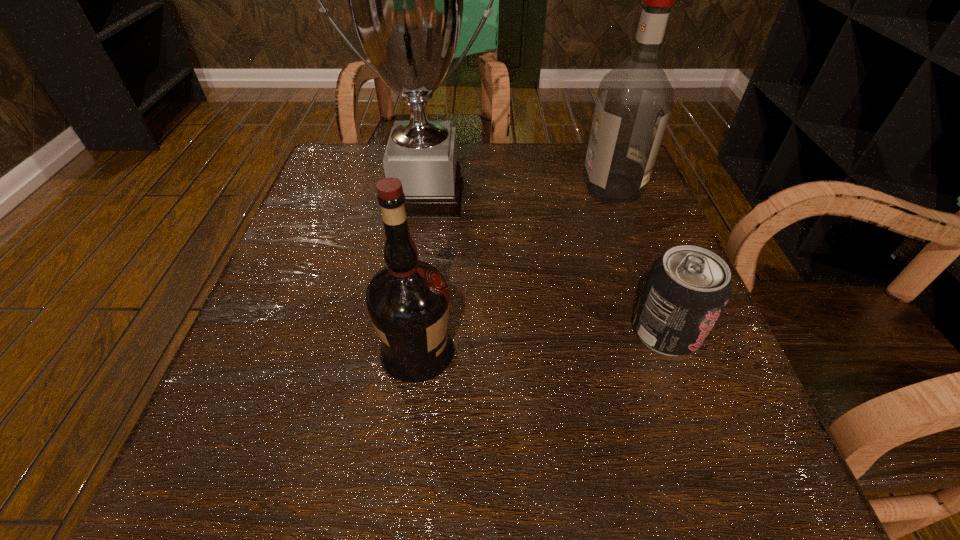
Where is `vacant space at the left edge`? This screenshot has height=540, width=960. vacant space at the left edge is located at coordinates (351, 308).

Image resolution: width=960 pixels, height=540 pixels. What are the coordinates of `vacant area at the right edge of the desktop` in the screenshot? It's located at (653, 226).

In the image, there is a desktop. Identify the location of free space at the far left corner. (362, 202).

Image resolution: width=960 pixels, height=540 pixels. Identify the location of free point at the far right corner. (580, 185).

This screenshot has height=540, width=960. What are the coordinates of `vacant space at the near right corner of the desktop` in the screenshot? It's located at (665, 442).

Locate an element on the screen. Image resolution: width=960 pixels, height=540 pixels. vacant space that is in between the trophy cup and the shortest object is located at coordinates (545, 264).

You are a GUI agent. You are given a task and a screenshot of the screen. Output one action in this format:
    pyautogui.click(x=<x>, y=<y>)
    Task: Click on the free area in between the tallest object and the right liquor
    The height and width of the screenshot is (540, 960).
    Given the screenshot: What is the action you would take?
    pyautogui.click(x=518, y=192)

Locate an element on the screen. The image size is (960, 540). empty space between the soda can and the farther liquor is located at coordinates (638, 260).

Locate an element on the screen. This screenshot has height=540, width=960. vacant point located between the third tallest object and the shortest object is located at coordinates (541, 342).

This screenshot has height=540, width=960. I want to click on unoccupied position between the shortest object and the shorter liquor, so click(541, 342).